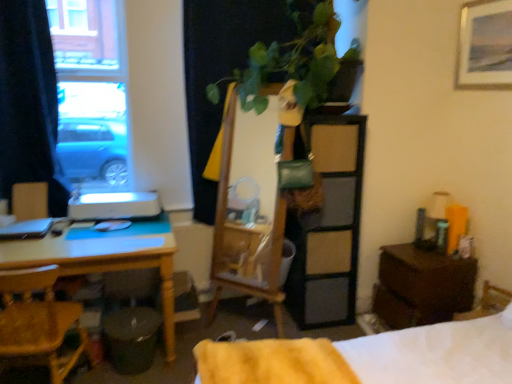
Question: In terms of height, does white soft bed at lower right look taller or shorter compared to black fabric curtain at left?

Choices:
 (A) short
 (B) tall

Answer: (A)

Question: Is point (228, 344) closer or farther from the camera than point (45, 140)?

Choices:
 (A) farther
 (B) closer

Answer: (B)

Question: Estimate the real-world distances between objects in this image. Which object is closer to the matte beige cabinet at center right, arranged as the second dresser when viewed from the left?

Choices:
 (A) green leafy plant at upper center
 (B) brown matte nightstand at lower right
 (C) black fabric curtain at left
 (D) wooden framed painting at upper right
 (E) yellow fluffy blanket at lower center

Answer: (B)

Question: Estimate the real-world distances between objects in this image. Which object is closer to the black fabric curtain at left?

Choices:
 (A) wooden mirror at center, which is the first dresser in left-to-right order
 (B) white soft bed at lower right
 (C) green leafy plant at upper center
 (D) blue glass window at upper left
 (E) wooden framed painting at upper right

Answer: (D)